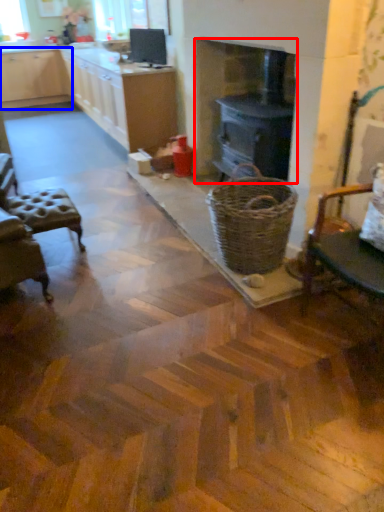
Question: Which object appears closest to the camera in this image, fireplace (highlighted by a red box) or cabinetry (highlighted by a blue box)?

Choices:
 (A) fireplace
 (B) cabinetry

Answer: (A)